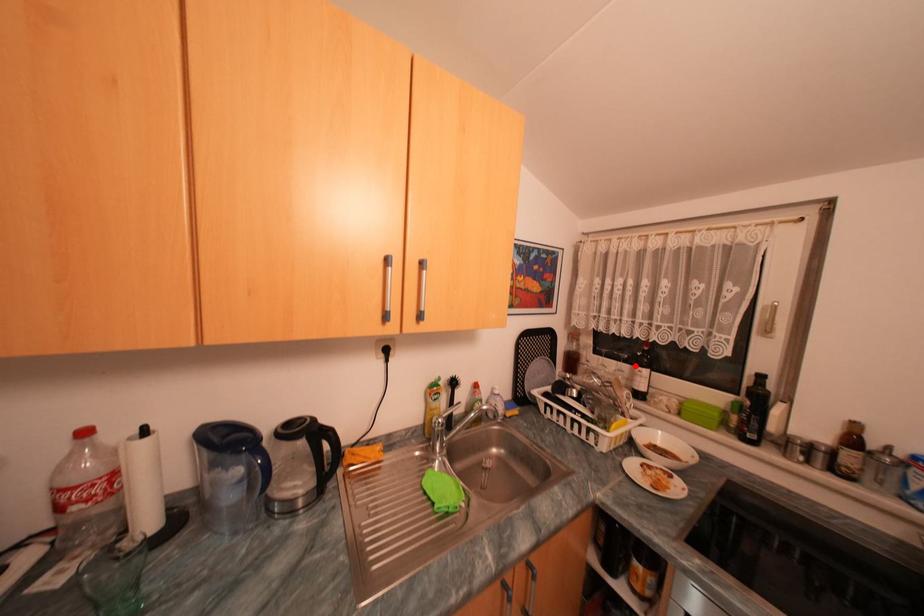
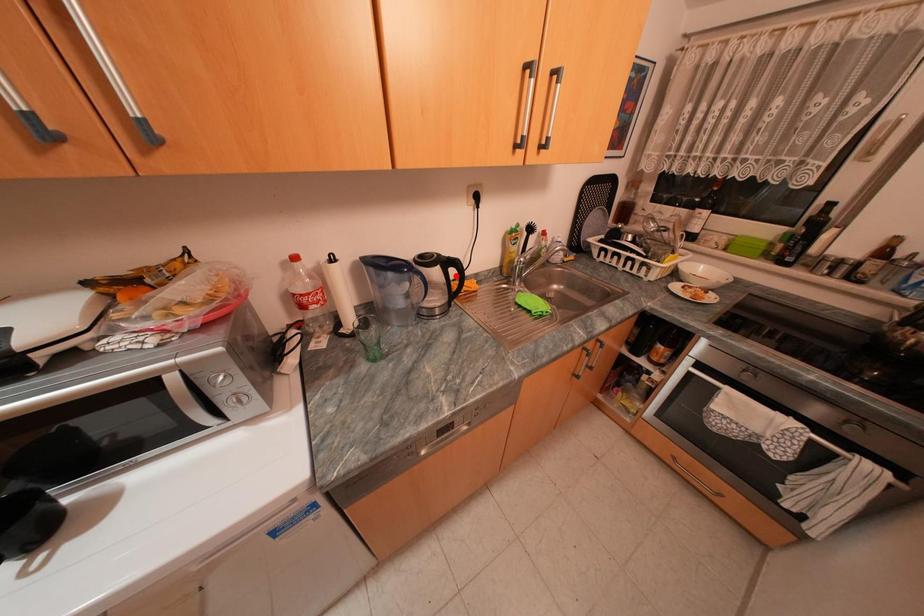
Consider the image. I am providing you with two images of the same scene from different viewpoints. A red point is marked on the first image and another point is marked on the second image. Are the points marked in image1 and image2 representing the same 3D position?

No